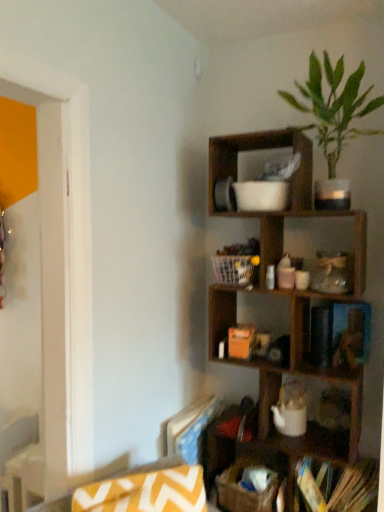
Question: Considering the positions of brown woven basket at lower center and green leafy plant at upper right in the image, is brown woven basket at lower center wider or thinner than green leafy plant at upper right?

Choices:
 (A) wide
 (B) thin

Answer: (B)

Question: Which is correct: brown woven basket at lower center is inside green leafy plant at upper right, or outside of it?

Choices:
 (A) inside
 (B) outside

Answer: (B)

Question: Which object is positioned closest to the green leafy plant at upper right?

Choices:
 (A) yellow zigzag fabric swivel chair at lower left
 (B) hardcover books at lower right
 (C) brown woven basket at lower center
 (D) wooden shelf at upper right
 (E) white plastic basket at center

Answer: (D)

Question: Estimate the real-world distances between objects in this image. Which object is farther from the brown woven basket at lower center?

Choices:
 (A) yellow zigzag fabric swivel chair at lower left
 (B) hardcover books at lower right
 (C) wooden shelf at upper right
 (D) white plastic basket at center
 (E) green leafy plant at upper right

Answer: (E)